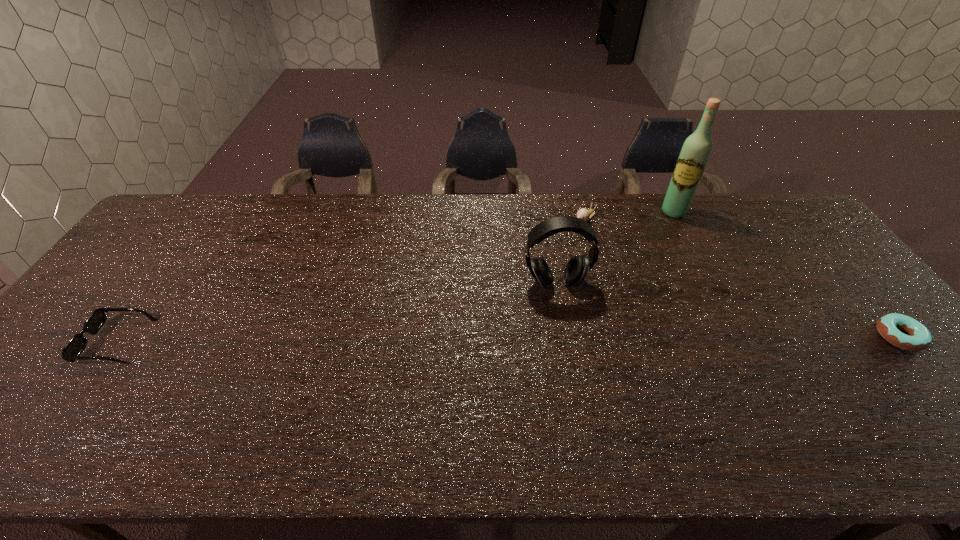
You are a GUI agent. You are given a task and a screenshot of the screen. Output one action in this format:
    pyautogui.click(x=<x>, y=<y>)
    Task: Click on the vacant space on the desktop that is between the leftmost object and the rightmost object and is positioned on the ear cups of the earphone
    
    Given the screenshot: What is the action you would take?
    pyautogui.click(x=570, y=339)

At what (x,y) coordinates should I click in order to perform the action: click on vacant spot on the desktop that is between the sunglasses and the rightmost object and is positioned on the shell of the escargot. Please return your answer as a coordinate pair (x, y). Looking at the image, I should click on (460, 339).

Where is `free space on the desktop that is between the leftmost object and the shortest object and is positioned on the front-facing side of the tallest object`? free space on the desktop that is between the leftmost object and the shortest object and is positioned on the front-facing side of the tallest object is located at coordinates [612, 338].